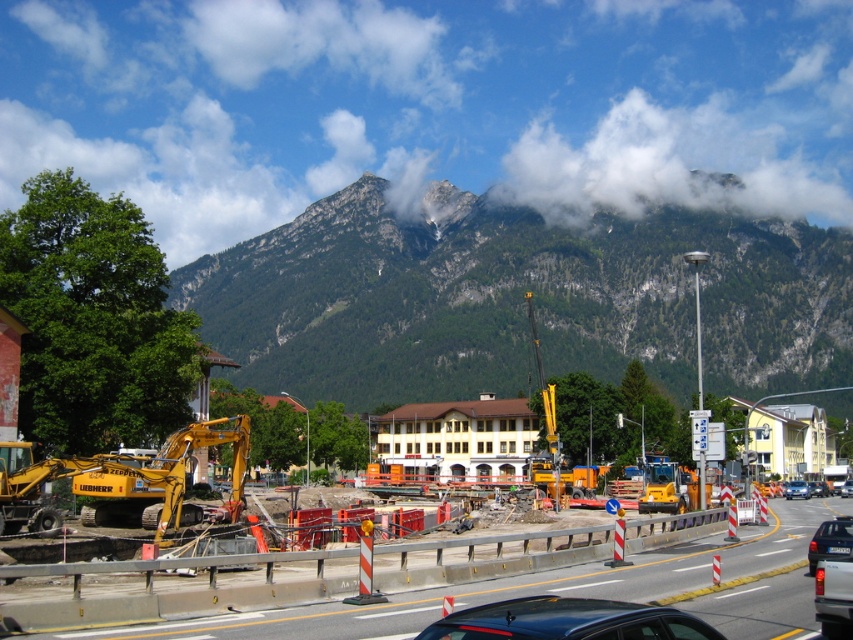
You are a delivery driver who needs to park your vehicle in the construction site. You see the shiny black car at center and the silver metallic sedan at center. Which vehicle is blocking the other one?

The shiny black car at center is positioned over silver metallic sedan at center, so it is blocking the silver metallic sedan at center.

You are a delivery driver who needs to park your shiny black car at center in a spot that is not obstructed by construction vehicles. Based on the scene, can you determine if the parking spot at point (567,621) is clear of any construction vehicles?

The point (567,621) indicates the location of the shiny black car at center, so the parking spot is occupied by the car and not clear of construction vehicles.